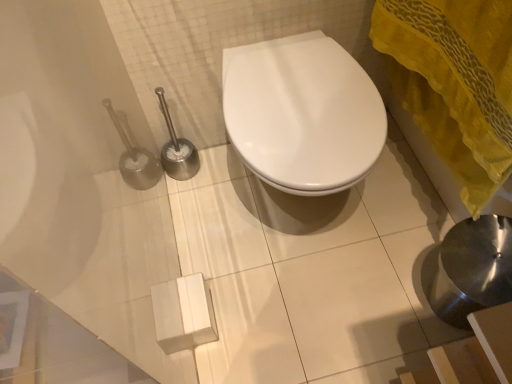
Question: Is yellow sheer fabric at right wider or thinner than white glossy toilet at center?

Choices:
 (A) wide
 (B) thin

Answer: (B)

Question: Considering their positions, is yellow sheer fabric at right located in front of or behind white glossy toilet at center?

Choices:
 (A) front
 (B) behind

Answer: (A)

Question: From a real-world perspective, relative to white glossy toilet at center, is yellow sheer fabric at right vertically above or below?

Choices:
 (A) above
 (B) below

Answer: (A)

Question: Considering the positions of point (274, 170) and point (458, 36), is point (274, 170) closer or farther from the camera than point (458, 36)?

Choices:
 (A) farther
 (B) closer

Answer: (A)

Question: From the image's perspective, is white glossy toilet at center located above or below yellow sheer fabric at right?

Choices:
 (A) above
 (B) below

Answer: (B)

Question: Is white glossy toilet at center taller or shorter than yellow sheer fabric at right?

Choices:
 (A) tall
 (B) short

Answer: (B)

Question: In the image, is white glossy toilet at center on the left side or the right side of yellow sheer fabric at right?

Choices:
 (A) left
 (B) right

Answer: (A)